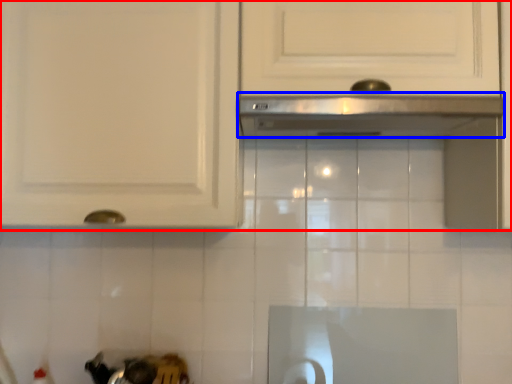
Question: Among these objects, which one is farthest to the camera, cabinetry (highlighted by a red box) or exhaust hood (highlighted by a blue box)?

Choices:
 (A) cabinetry
 (B) exhaust hood

Answer: (A)